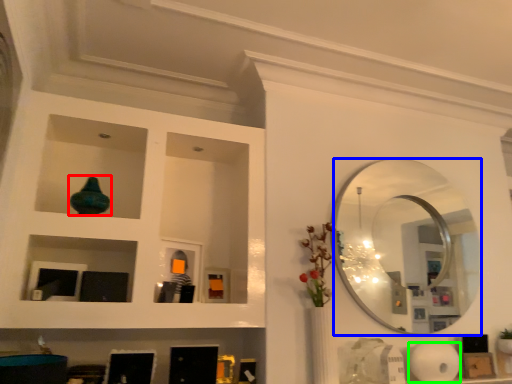
Question: Which object is the closest to the glass vase (highlighted by a red box)? Choose among these: mirror (highlighted by a blue box) or paper towel (highlighted by a green box).

Choices:
 (A) mirror
 (B) paper towel

Answer: (A)